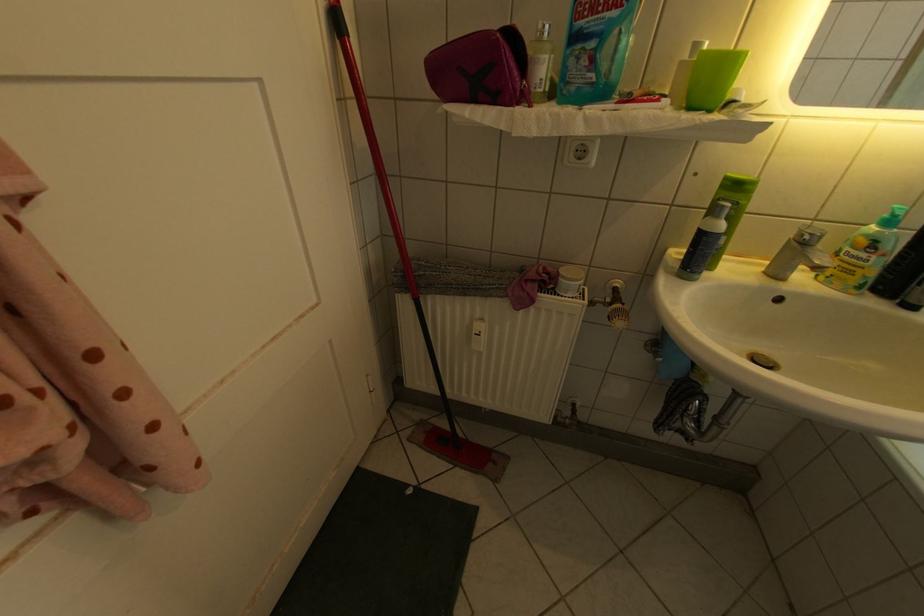
The height and width of the screenshot is (616, 924). What do you see at coordinates (864, 254) in the screenshot?
I see `a blue cleaner bottle` at bounding box center [864, 254].